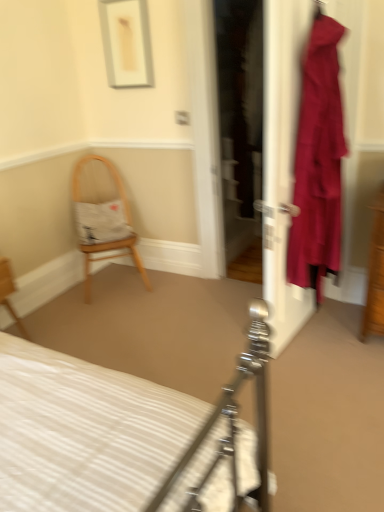
Question: Considering the relative positions of white striped fabric bed at center and wooden chair at lower left, which ranks as the first chair in front-to-back order, in the image provided, is white striped fabric bed at center behind wooden chair at lower left, which ranks as the first chair in front-to-back order,?

Choices:
 (A) yes
 (B) no

Answer: (B)

Question: Is white striped fabric bed at center next to wooden chair at lower left, which ranks as the first chair in front-to-back order?

Choices:
 (A) no
 (B) yes

Answer: (A)

Question: Is white striped fabric bed at center at the left side of wooden chair at lower left, which is the first chair in left-to-right order?

Choices:
 (A) no
 (B) yes

Answer: (A)

Question: Considering the relative sizes of white striped fabric bed at center and wooden chair at lower left, which ranks as the 2th chair in right-to-left order, in the image provided, is white striped fabric bed at center thinner than wooden chair at lower left, which ranks as the 2th chair in right-to-left order,?

Choices:
 (A) no
 (B) yes

Answer: (A)

Question: Is white striped fabric bed at center wider than wooden chair at lower left, placed as the 2th chair when sorted from back to front?

Choices:
 (A) yes
 (B) no

Answer: (A)

Question: Considering the positions of velvet-like burgundy dress at right and wooden chair at lower left, which is the first chair in left-to-right order, in the image, is velvet-like burgundy dress at right bigger or smaller than wooden chair at lower left, which is the first chair in left-to-right order,?

Choices:
 (A) small
 (B) big

Answer: (B)

Question: In terms of width, does velvet-like burgundy dress at right look wider or thinner when compared to wooden chair at lower left, which ranks as the first chair in front-to-back order?

Choices:
 (A) thin
 (B) wide

Answer: (B)

Question: Is point (294, 244) positioned closer to the camera than point (0, 284)?

Choices:
 (A) farther
 (B) closer

Answer: (B)

Question: In terms of height, does velvet-like burgundy dress at right look taller or shorter compared to wooden chair at lower left, placed as the 2th chair when sorted from back to front?

Choices:
 (A) short
 (B) tall

Answer: (B)

Question: From the image's perspective, is wooden chair with cushion at left, the second chair viewed from the left, above or below matte white door at right?

Choices:
 (A) below
 (B) above

Answer: (A)

Question: Is wooden chair with cushion at left, the second chair viewed from the left, in front of or behind matte white door at right in the image?

Choices:
 (A) behind
 (B) front

Answer: (A)

Question: Looking at their shapes, would you say wooden chair with cushion at left, the second chair viewed from the front, is wider or thinner than matte white door at right?

Choices:
 (A) thin
 (B) wide

Answer: (B)

Question: In terms of height, does wooden chair with cushion at left, the 1th chair viewed from the back, look taller or shorter compared to matte white door at right?

Choices:
 (A) short
 (B) tall

Answer: (A)

Question: In terms of width, does matte white door at right look wider or thinner when compared to white striped fabric bed at center?

Choices:
 (A) wide
 (B) thin

Answer: (B)

Question: Based on their positions, is matte white door at right located to the left or right of white striped fabric bed at center?

Choices:
 (A) left
 (B) right

Answer: (B)